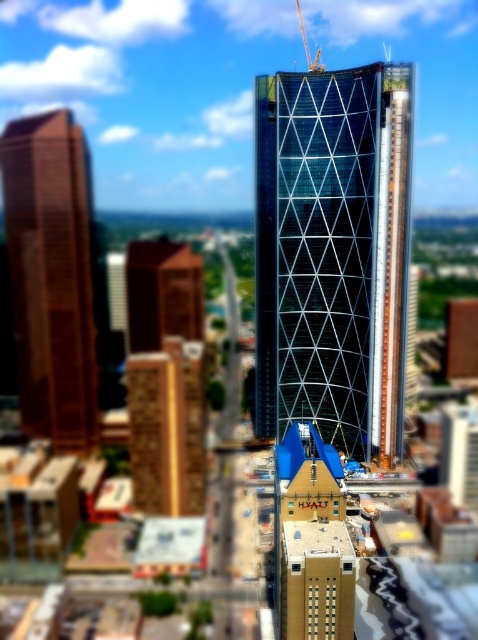
Is the position of brown polished wood tower at left less distant than that of brown wooden tower at center?

Yes, it is.

Which is behind, point (26, 412) or point (156, 260)?

Point (156, 260)

Is point (97, 372) more distant than point (130, 284)?

No, it is in front of (130, 284).

The width and height of the screenshot is (478, 640). I want to click on brown polished wood tower at left, so click(x=52, y=276).

Does glassy steel tower at center have a lesser height compared to yellow metallic crane at center?

In fact, glassy steel tower at center may be taller than yellow metallic crane at center.

Is glassy steel tower at center closer to the viewer compared to yellow metallic crane at center?

Yes, it is in front of yellow metallic crane at center.

Which is in front, point (283, 232) or point (304, 45)?

Point (283, 232)

Image resolution: width=478 pixels, height=640 pixels. Find the location of `glassy steel tower at center`. glassy steel tower at center is located at coordinates (334, 253).

Is brown textured building at center above yellow metallic crane at center?

Incorrect, brown textured building at center is not positioned above yellow metallic crane at center.

Identify the location of brown textured building at center. This screenshot has height=640, width=478. (167, 428).